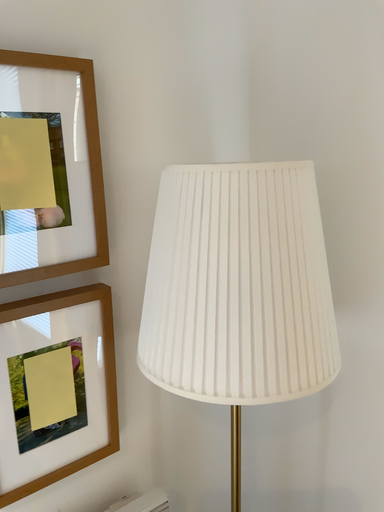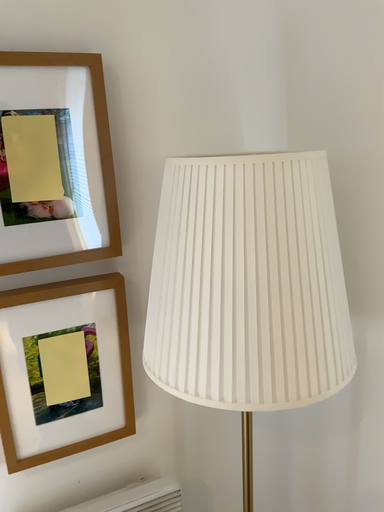
Question: How did the camera likely rotate when shooting the video?

Choices:
 (A) rotated left
 (B) rotated right

Answer: (A)